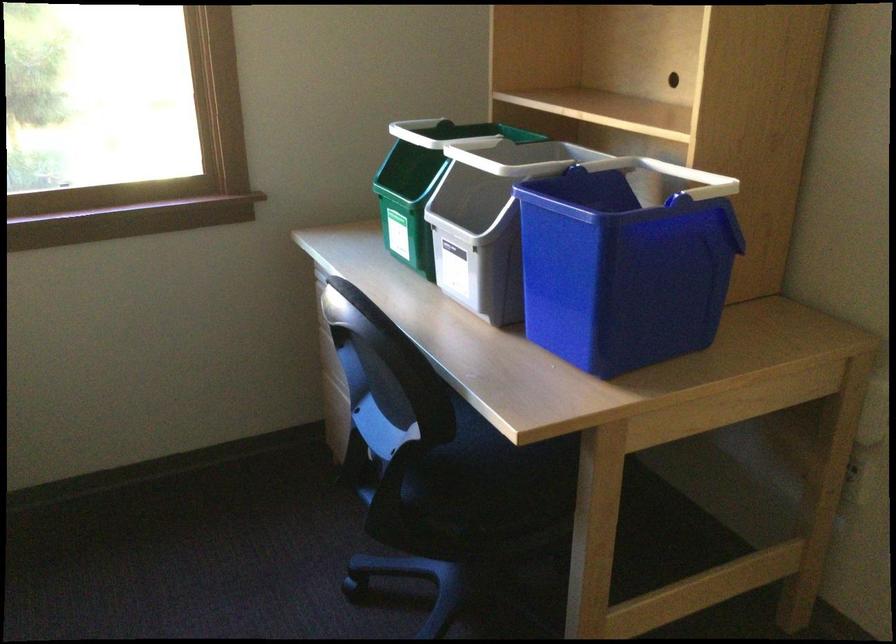
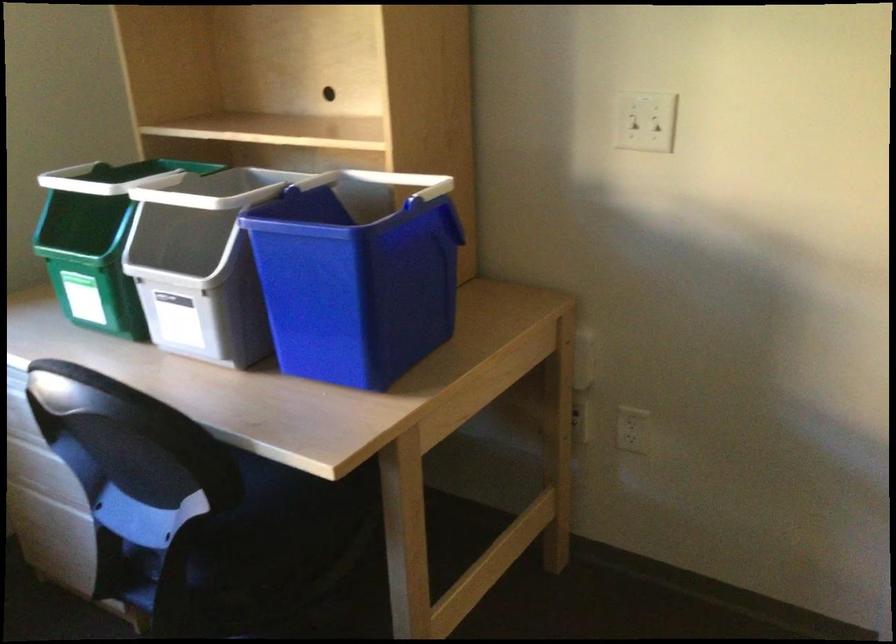
Where in the second image is the point corresponding to (x=686, y=173) from the first image?

(399, 181)